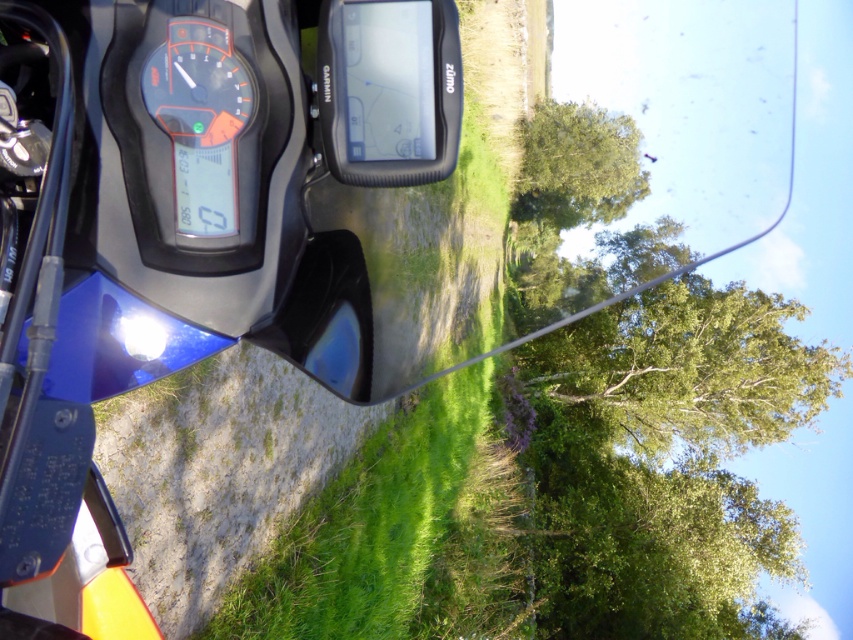
Question: Can you confirm if blue glossy motorcycle at center is positioned to the right of transparent plastic gps at center?

Choices:
 (A) yes
 (B) no

Answer: (B)

Question: Among these objects, which one is farthest from the camera?

Choices:
 (A) green leafy tree at upper center
 (B) blue glossy motorcycle at center
 (C) orange glossy gauge at center

Answer: (A)

Question: Does transparent plastic gps at center have a larger size compared to green leafy tree at upper center?

Choices:
 (A) yes
 (B) no

Answer: (B)

Question: Which object is closer to the camera taking this photo?

Choices:
 (A) transparent plastic gps at center
 (B) orange glossy gauge at center

Answer: (B)

Question: Does blue glossy motorcycle at center appear over orange glossy gauge at center?

Choices:
 (A) yes
 (B) no

Answer: (B)

Question: Among these points, which one is farthest from the camera?

Choices:
 (A) (50, 312)
 (B) (326, 68)
 (C) (564, 168)
 (D) (190, 134)

Answer: (C)